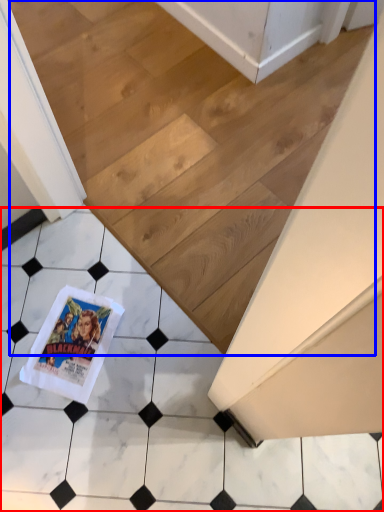
Question: Among these objects, which one is farthest to the camera, tile (highlighted by a red box) or stairwell (highlighted by a blue box)?

Choices:
 (A) tile
 (B) stairwell

Answer: (B)